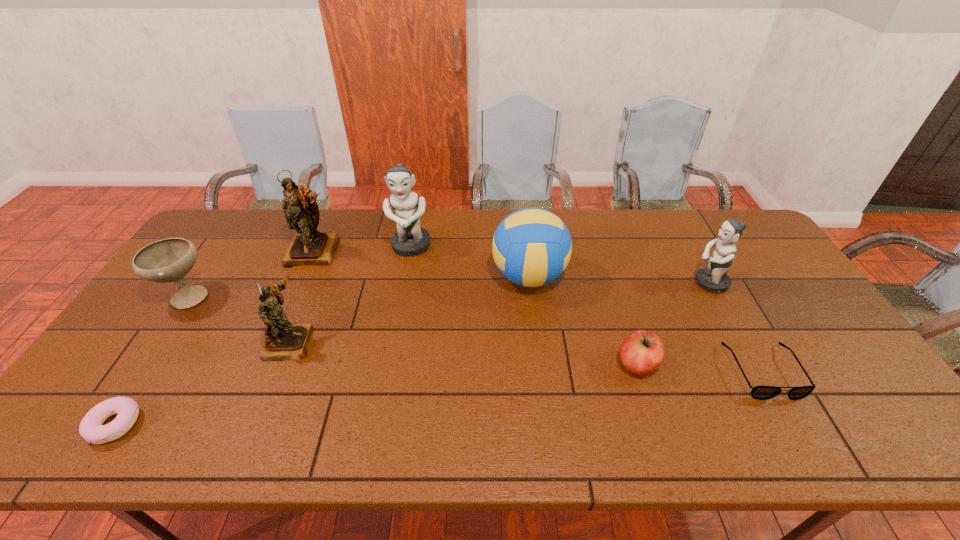
Identify the location of the bigger green figurine. This screenshot has width=960, height=540. (410, 239).

Locate an element on the screen. the third figurine from left to right is located at coordinates (410, 239).

Locate an element on the screen. the bigger gold figurine is located at coordinates (309, 247).

Identify the location of blue volleyball. The width and height of the screenshot is (960, 540). (531, 247).

Where is `volleyball`? volleyball is located at coordinates (531, 247).

This screenshot has width=960, height=540. In order to click on the nearer gold figurine in this screenshot , I will do `click(284, 341)`.

You are a GUI agent. You are given a task and a screenshot of the screen. Output one action in this format:
    pyautogui.click(x=<x>, y=<y>)
    Task: Click on the nearest figurine
    
    Given the screenshot: What is the action you would take?
    pyautogui.click(x=284, y=341)

Locate an element on the screen. the right green figurine is located at coordinates (714, 278).

In order to click on the smaller green figurine in this screenshot , I will do `click(714, 278)`.

The image size is (960, 540). Find the location of `the sixth tallest object`. the sixth tallest object is located at coordinates (169, 260).